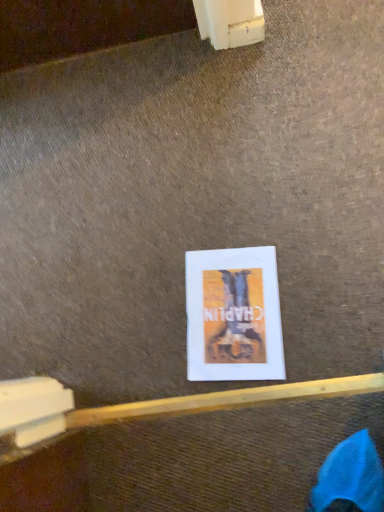
What are the coordinates of `free point below white paper at center (from a real-world perspective)` in the screenshot? It's located at (230, 312).